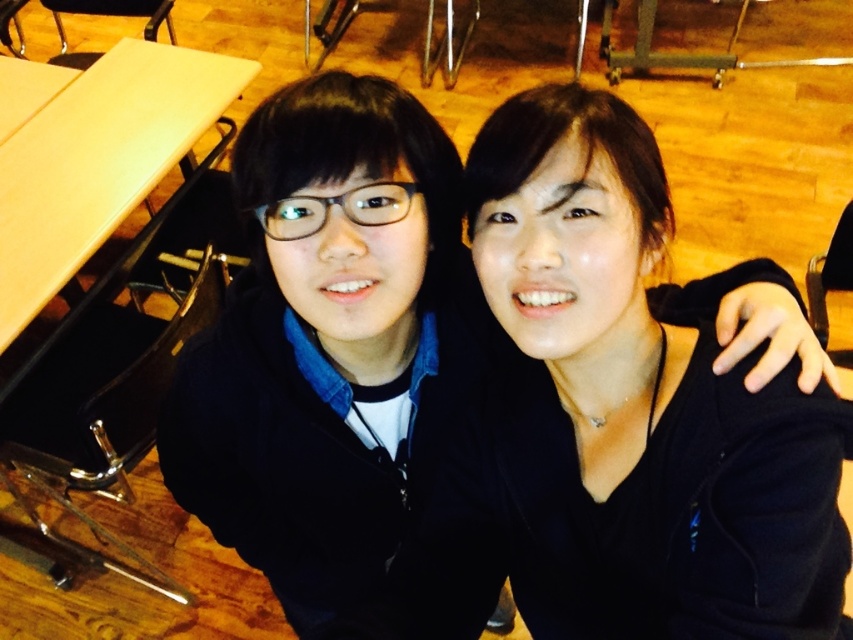
Question: Is black matte jacket at center thinner than light wood table at upper left?

Choices:
 (A) no
 (B) yes

Answer: (B)

Question: Which point is farther to the camera?

Choices:
 (A) 550,88
 (B) 4,298

Answer: (B)

Question: Does black matte jacket at center lie behind light wood table at upper left?

Choices:
 (A) yes
 (B) no

Answer: (B)

Question: Can you confirm if black matte jacket at center is positioned below light wood table at upper left?

Choices:
 (A) no
 (B) yes

Answer: (B)